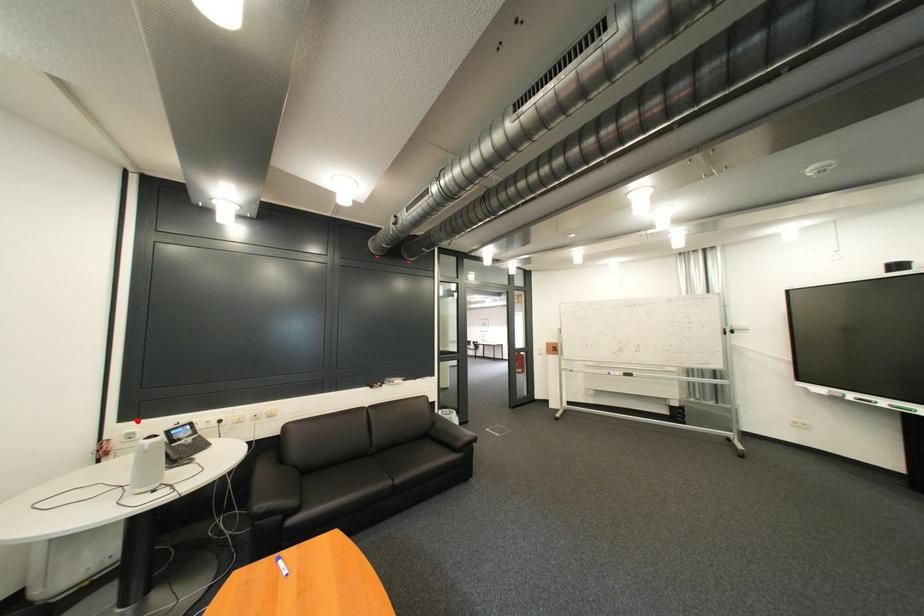
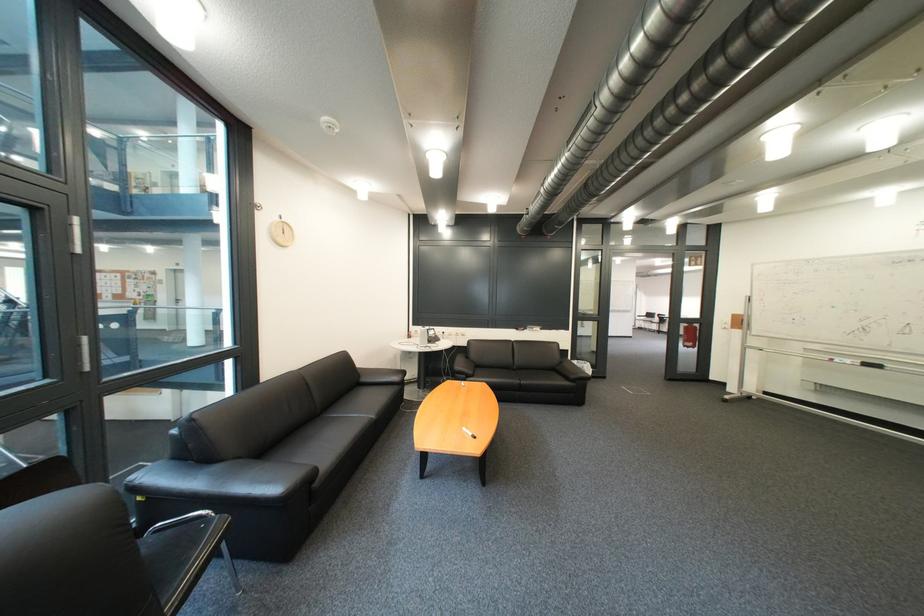
Question: I am providing you with two images of the same scene from different viewpoints. Given a red point in image1, look at the same physical point in image2. Is it:

Choices:
 (A) Closer to the viewpoint
 (B) Farther from the viewpoint

Answer: (B)